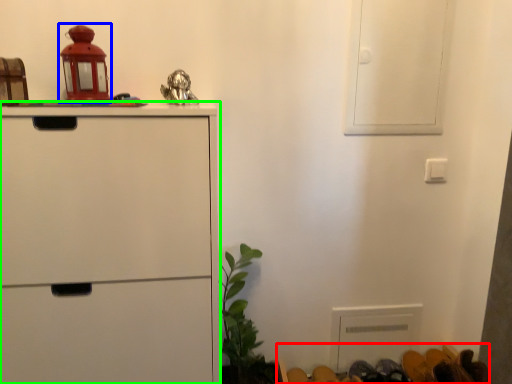
Question: Which object is positioned farthest from furniture (highlighted by a red box)? Select from toy (highlighted by a blue box) and chest of drawers (highlighted by a green box).

Choices:
 (A) toy
 (B) chest of drawers

Answer: (A)